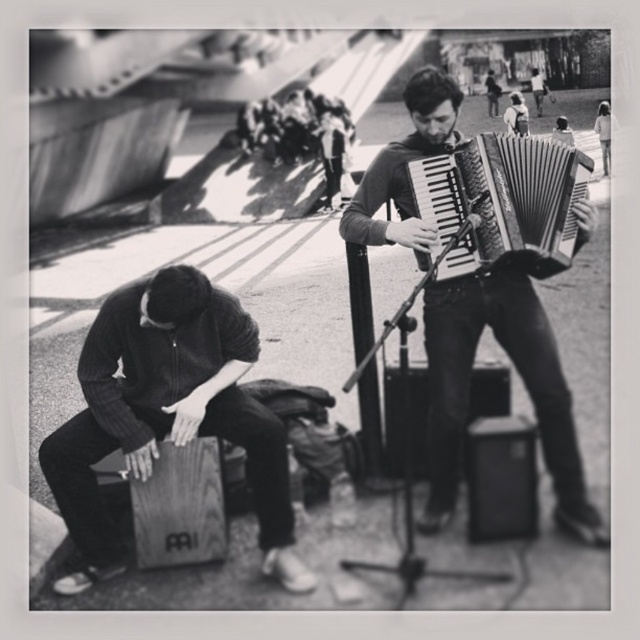
You are a spectator standing in front of the wooden cajon at lower left and the metallic silver accordion at center. Which musician is closer to you?

The wooden cajon at lower left is closer to you because the metallic silver accordion at center is positioned behind it.

You are a photographer trying to capture both the wooden cajon at lower left and the metallic silver accordion at center in a single frame. Based on their sizes, which object should you position closer to the edge of the frame to ensure both fit without cropping?

The wooden cajon at lower left is wider than the metallic silver accordion at center, so you should position the wider wooden cajon at lower left closer to the edge of the frame to accommodate its larger size while keeping the metallic silver accordion at center more centered.

In the scene shown: You are organizing a small outdoor concert and need to place a 1.2 meter wide amplifier between the wooden cajon at lower left and the metallic accordion at center. Based on their widths, will the amplifier fit between them?

The wooden cajon at lower left is wider than the metallic accordion at center. Since the amplifier is 1.2 meters wide, but the space between them depends on their combined widths. However, without knowing the exact distance between the two instruments, we cannot determine if the amplifier will fit. Please measure the actual space available.